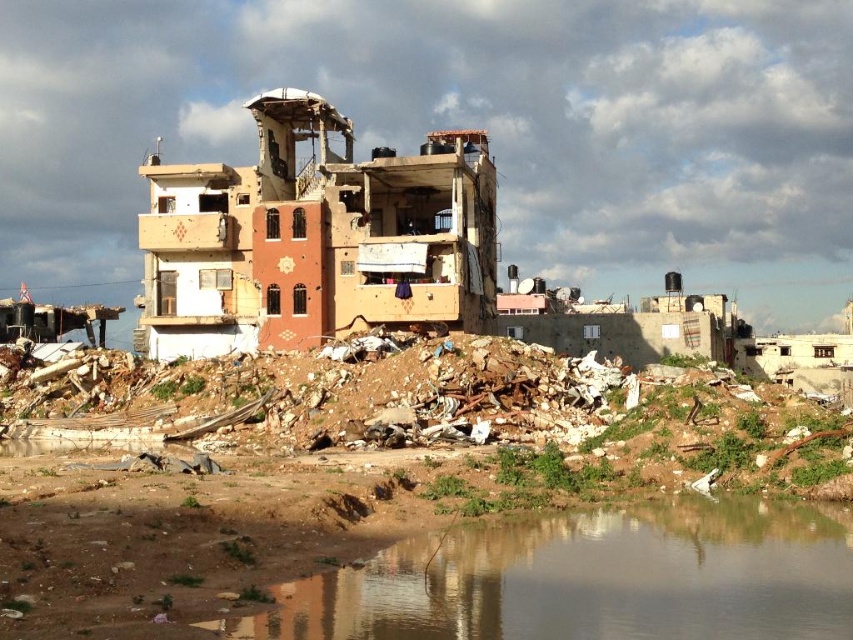
You are a rescue worker assessing the damage in the area. You see the brown textured building at center and the brown dirt at lower center. Which object is taller?

The brown textured building at center is taller than the brown dirt at lower center.

You are a drone operator tasked with assessing damage in a conflict zone. Your mission requires you to fly your drone to the brown textured building at center to capture high resolution images. Given that the drone can only hover at coordinates within a radius of 0.3 units from the building, can you confirm if the drone will be able to safely hover near the building without exceeding its operational radius?

The brown textured building at center is located at point (316,237). Since the drone can only hover within a radius of 0.3 units from the building, the coordinates are slightly beyond the operational radius. Therefore, the drone cannot safely hover near the building without exceeding its operational limits.